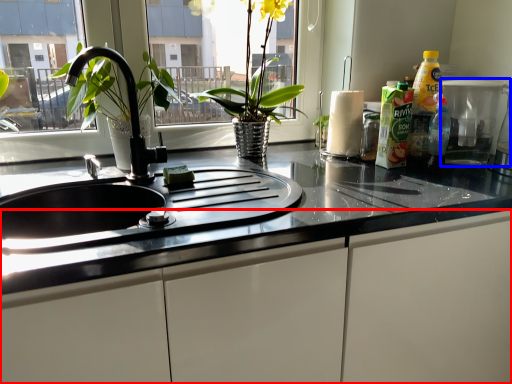
Question: Among these objects, which one is farthest to the camera, cabinetry (highlighted by a red box) or appliance (highlighted by a blue box)?

Choices:
 (A) cabinetry
 (B) appliance

Answer: (B)